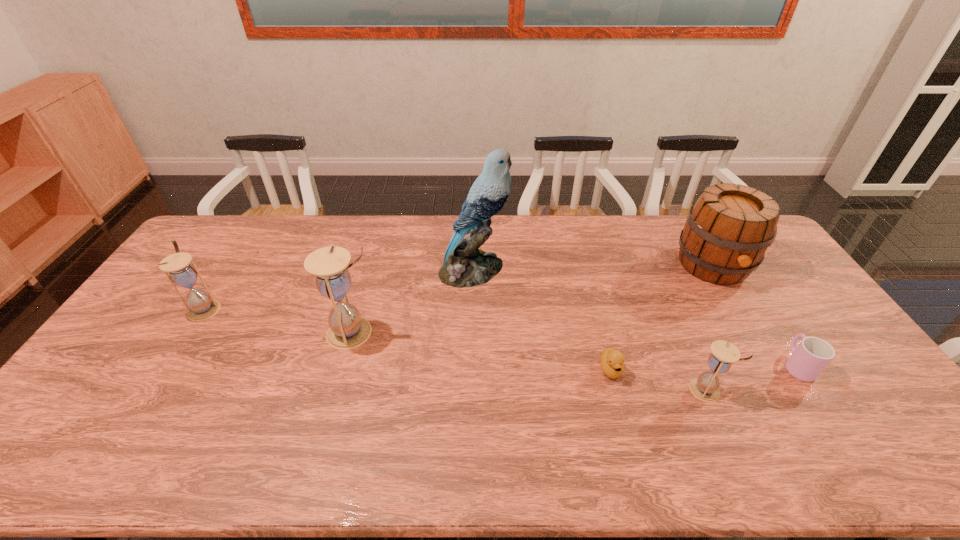
Locate an element on the screen. The width and height of the screenshot is (960, 540). free location located on the face of the duckling is located at coordinates (625, 422).

The height and width of the screenshot is (540, 960). Identify the location of cider at the far edge. (729, 228).

Where is `parakeet that is positioned at the far edge`? parakeet that is positioned at the far edge is located at coordinates (465, 265).

Where is `object that is at the near edge`? The image size is (960, 540). object that is at the near edge is located at coordinates (705, 387).

At what (x,y) coordinates should I click in order to perform the action: click on object that is positioned at the left edge. Please return your answer as a coordinate pair (x, y). The height and width of the screenshot is (540, 960). Looking at the image, I should click on (201, 306).

Image resolution: width=960 pixels, height=540 pixels. In order to click on cider that is positioned at the right edge in this screenshot , I will do `click(729, 228)`.

At what (x,y) coordinates should I click in order to perform the action: click on cup present at the right edge. Please return your answer as a coordinate pair (x, y). The image size is (960, 540). Looking at the image, I should click on (812, 355).

Locate an element on the screen. This screenshot has width=960, height=540. object that is at the far right corner is located at coordinates (729, 228).

The width and height of the screenshot is (960, 540). Identify the location of free region at the far edge. (677, 253).

In the image, there is a desktop. Identify the location of vacant region at the near edge. Image resolution: width=960 pixels, height=540 pixels. (139, 409).